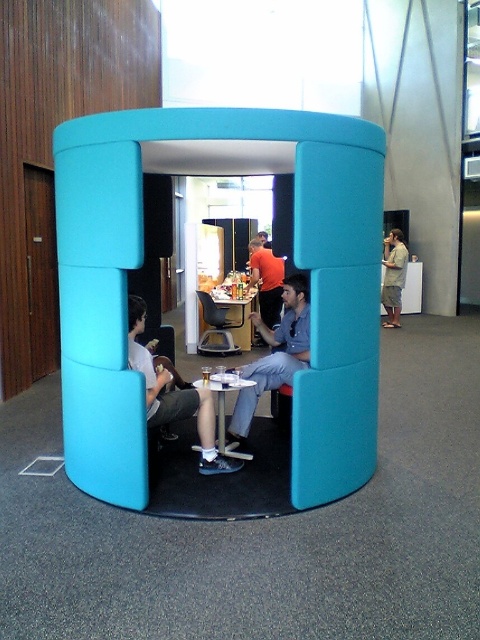
You are standing at the entrance of the cylindrical seating area and want to place a new chair at the point marked as point (224, 410). Is this point located inside the seating area or outside?

The point 0.647, 0.467 indicates the white plastic table at center, which is inside the seating area. Therefore, placing the chair at this point would be inside the seating area.

You are standing in the room and want to place a small plant between the two points, point (217, 400) and point (227, 300). Which point should the plant be closer to if you want it to appear larger in the camera view?

The plant should be placed closer to point (217, 400) because it is closer to the camera than point (227, 300), making it appear larger in the camera view.

You are planning to place a large decorative vase on the table in the image. The vase has a diameter of 30 cm. Which table, the white plastic table at center or the metallic silver table at center, can accommodate the vase without it overhanging the edge?

The metallic silver table at center is thicker than the white plastic table at center. Since the vase has a diameter of 30 cm, the metallic silver table at center likely has a larger surface area and can accommodate the vase without overhanging.